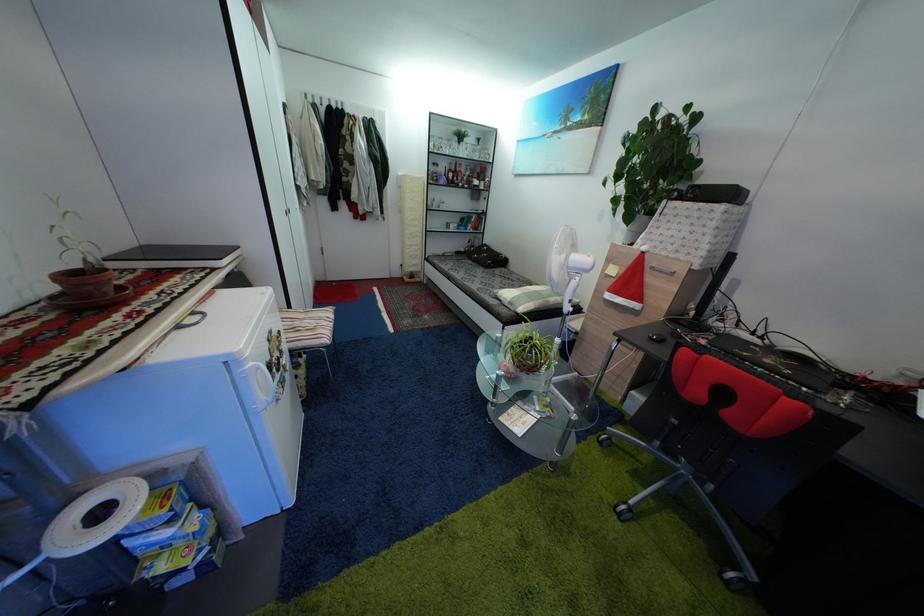
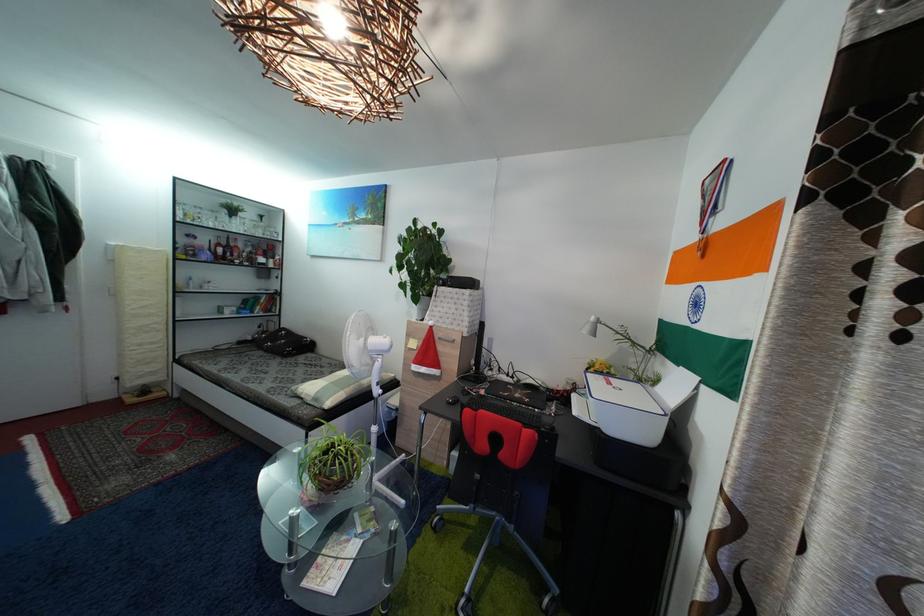
The point at [451,174] is marked in the first image. Where is the corresponding point in the second image?

(213, 246)